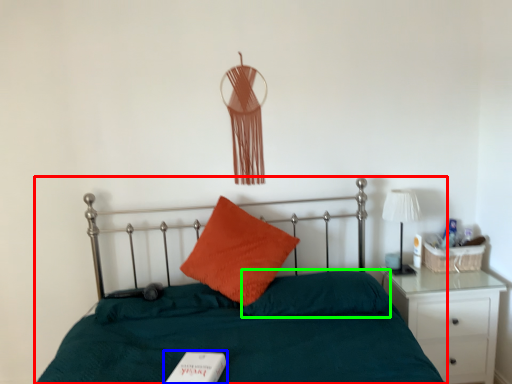
Question: Based on their relative distances, which object is nearer to bed (highlighted by a red box)? Choose from book (highlighted by a blue box) and pillow (highlighted by a green box).

Choices:
 (A) book
 (B) pillow

Answer: (B)